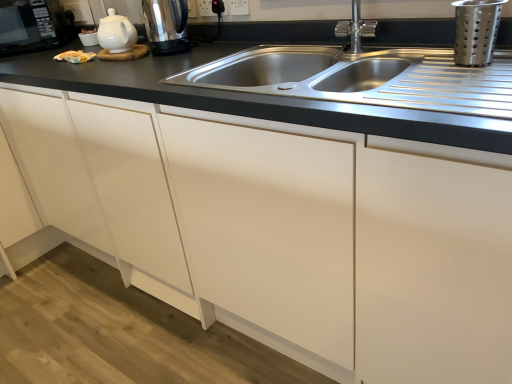
Where is `vacant area that lies between silver metallic faucet at upper center and metallic silver strainer at upper right, marked as the first appliance in a front-to-back arrangement`? vacant area that lies between silver metallic faucet at upper center and metallic silver strainer at upper right, marked as the first appliance in a front-to-back arrangement is located at coordinates (406, 60).